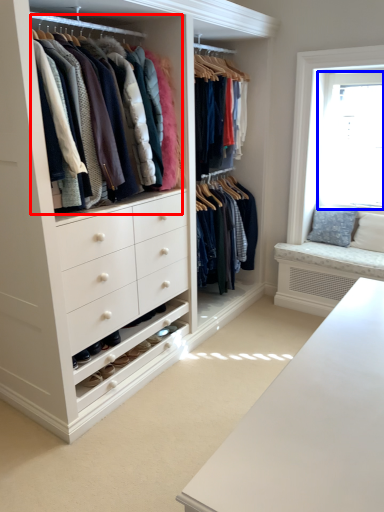
Question: Which object appears closest to the camera in this image, closet (highlighted by a red box) or bay window (highlighted by a blue box)?

Choices:
 (A) closet
 (B) bay window

Answer: (A)